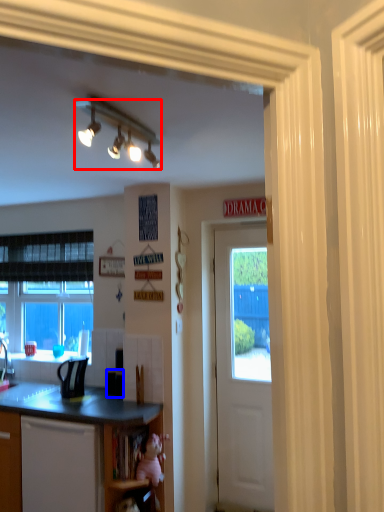
Question: Which object appears farthest to the camera in this image, lamp (highlighted by a red box) or microwave oven (highlighted by a blue box)?

Choices:
 (A) lamp
 (B) microwave oven

Answer: (B)